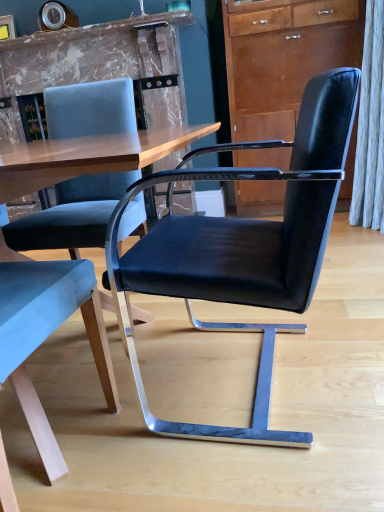
Question: Does black leather chair at center, marked as the 1th chair in a right-to-left arrangement, appear on the right side of velvet blue chair at left, the first chair from the left?

Choices:
 (A) yes
 (B) no

Answer: (A)

Question: Is velvet blue chair at left, which appears as the 2th chair when viewed from the right, surrounded by black leather chair at center, placed as the second chair when sorted from left to right?

Choices:
 (A) no
 (B) yes

Answer: (A)

Question: Is black leather chair at center, placed as the second chair when sorted from left to right, turned away from velvet blue chair at left, which appears as the 2th chair when viewed from the right?

Choices:
 (A) no
 (B) yes

Answer: (A)

Question: Does black leather chair at center, placed as the second chair when sorted from left to right, have a greater width compared to velvet blue chair at left, which appears as the 2th chair when viewed from the right?

Choices:
 (A) yes
 (B) no

Answer: (A)

Question: Is black leather chair at center, placed as the second chair when sorted from left to right, positioned beyond the bounds of velvet blue chair at left, the first chair from the left?

Choices:
 (A) yes
 (B) no

Answer: (A)

Question: Considering the relative positions of black leather chair at center, placed as the second chair when sorted from left to right, and velvet blue chair at left, which appears as the 2th chair when viewed from the right, in the image provided, is black leather chair at center, placed as the second chair when sorted from left to right, to the left of velvet blue chair at left, which appears as the 2th chair when viewed from the right, from the viewer's perspective?

Choices:
 (A) no
 (B) yes

Answer: (A)

Question: From the image's perspective, is velvet blue chair at left, the first chair from the left, on top of matte brown cabinet at upper right?

Choices:
 (A) no
 (B) yes

Answer: (A)

Question: From a real-world perspective, is velvet blue chair at left, which appears as the 2th chair when viewed from the right, below matte brown cabinet at upper right?

Choices:
 (A) no
 (B) yes

Answer: (B)

Question: Is velvet blue chair at left, the first chair from the left, outside of matte brown cabinet at upper right?

Choices:
 (A) no
 (B) yes

Answer: (B)

Question: Can you confirm if velvet blue chair at left, which appears as the 2th chair when viewed from the right, is smaller than matte brown cabinet at upper right?

Choices:
 (A) yes
 (B) no

Answer: (A)

Question: From the image's perspective, would you say velvet blue chair at left, which appears as the 2th chair when viewed from the right, is shown under matte brown cabinet at upper right?

Choices:
 (A) yes
 (B) no

Answer: (A)

Question: Is velvet blue chair at left, the first chair from the left, not near matte brown cabinet at upper right?

Choices:
 (A) no
 (B) yes

Answer: (B)

Question: Is matte brown cabinet at upper right bigger than velvet blue chair at left, the first chair from the left?

Choices:
 (A) yes
 (B) no

Answer: (A)